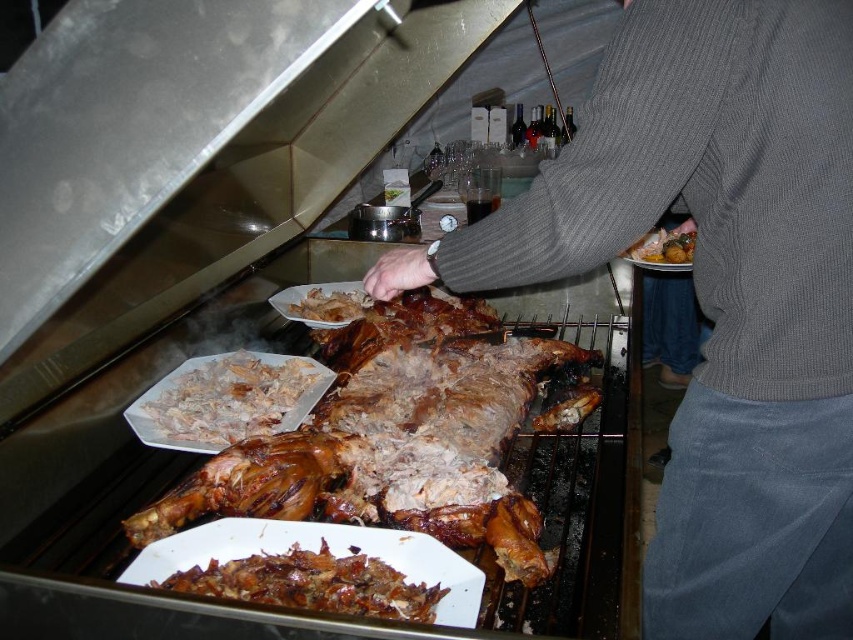
Which is in front, point (712, 116) or point (669, 257)?

Point (712, 116)

Who is shorter, gray ribbed sweater at center or shiny metallic plate at center?

With less height is shiny metallic plate at center.

Which is behind, point (738, 438) or point (683, 236)?

The point (683, 236) is behind.

Locate an element on the screen. This screenshot has width=853, height=640. gray ribbed sweater at center is located at coordinates (717, 292).

Who is positioned more to the left, brown crispy roasted lamb at center or shiny metallic plate at center?

brown crispy roasted lamb at center is more to the left.

Measure the distance from brown crispy roasted lamb at center to shiny metallic plate at center.

They are 20.25 inches apart.

Is point (323, 465) less distant than point (675, 230)?

Yes, point (323, 465) is in front of point (675, 230).

The height and width of the screenshot is (640, 853). Find the location of `brown crispy roasted lamb at center`. brown crispy roasted lamb at center is located at coordinates (372, 429).

Does brown crispy skin at center appear under translucent white shredded food at center?

Indeed, brown crispy skin at center is positioned under translucent white shredded food at center.

Between brown crispy skin at center and translucent white shredded food at center, which one is positioned lower?

brown crispy skin at center is below.

Is point (381, 593) less distant than point (306, 312)?

Yes, it is.

Image resolution: width=853 pixels, height=640 pixels. Find the location of `brown crispy skin at center`. brown crispy skin at center is located at coordinates [312, 582].